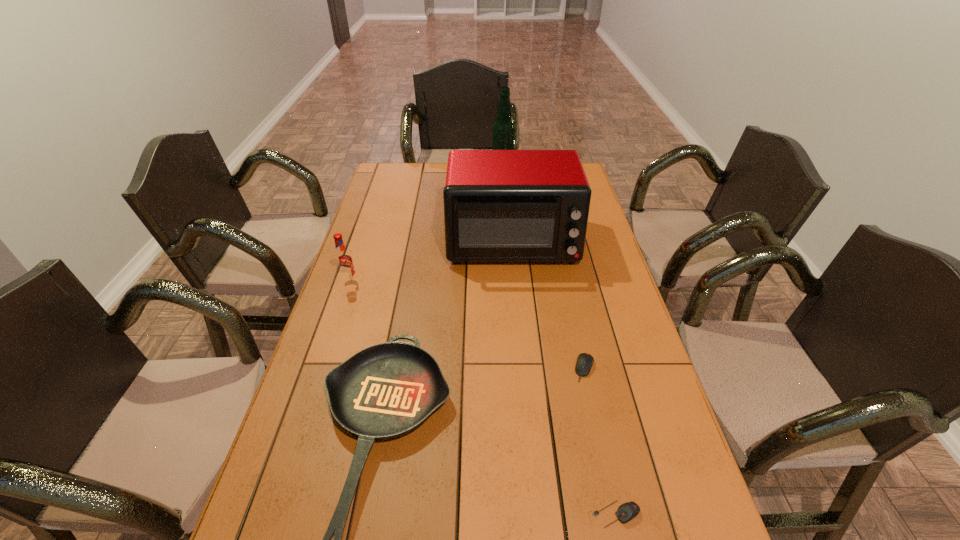
Locate an element on the screen. free space that satisfies the following two spatial constraints: 1. on the front side of the shortest object; 2. on the right side of the fourth nearest object is located at coordinates (271, 514).

Locate an element on the screen. The image size is (960, 540). vacant point that satisfies the following two spatial constraints: 1. on the front-facing side of the nearer mouse; 2. on the left side of the second farthest object is located at coordinates (537, 514).